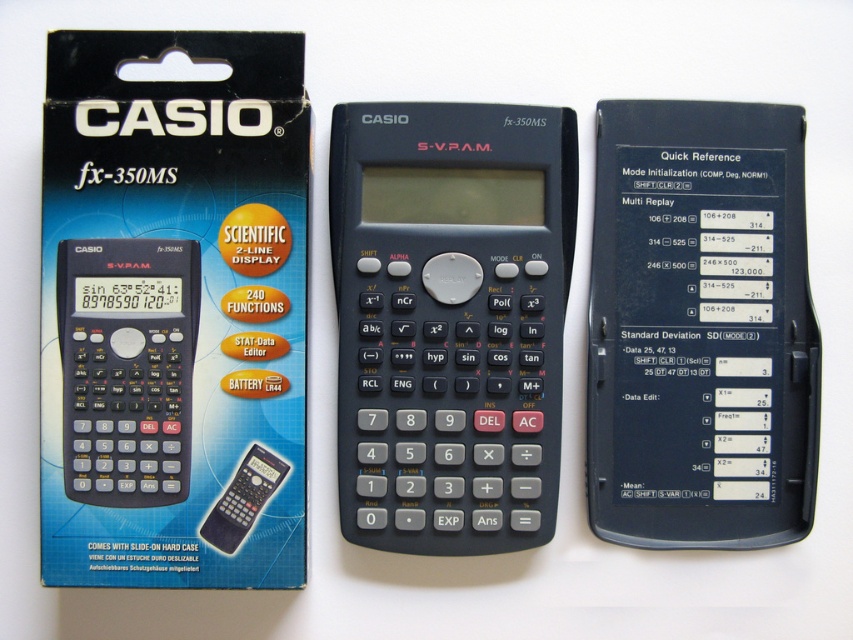
You are positioning a black plastic calculator at center for a product photo. The camera is focused at point 0.5, 0.5 on the image grid. Is the calculator centered correctly?

The black plastic calculator at center is located at point (450, 321), which is very close to the camera focus point (426, 320). Therefore, it is centered correctly.

You are standing in front of the Casio fx 350MS calculator and its packaging. You see two points labeled as point (123, 412) and point (218, 541). Which point is closer to you?

Point (123, 412) is in front of point (218, 541), so it is closer to you.

You are trying to determine which calculator is taller between the matte black calculator at center and the black matte calculator at center. Which one is taller?

The matte black calculator at center is taller than the black matte calculator at center.